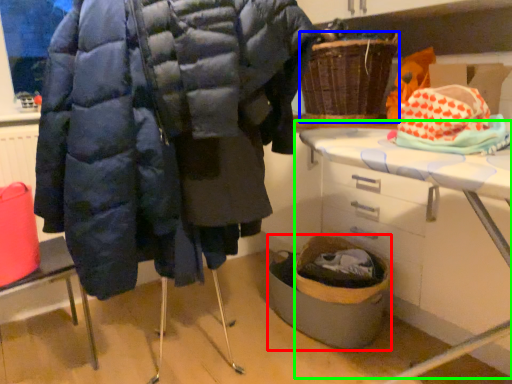
Question: Which object is positioned farthest from basket container (highlighted by a red box)? Select from basket (highlighted by a blue box) and table (highlighted by a green box).

Choices:
 (A) basket
 (B) table

Answer: (A)